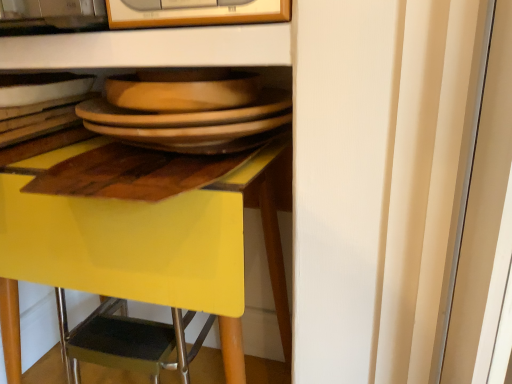
Question: Is brown matte plate at center smaller than matte wooden platter at center?

Choices:
 (A) no
 (B) yes

Answer: (B)

Question: Is brown matte plate at center located outside matte wooden platter at center?

Choices:
 (A) no
 (B) yes

Answer: (B)

Question: Considering the relative positions of brown matte plate at center and matte wooden platter at center in the image provided, is brown matte plate at center to the right of matte wooden platter at center from the viewer's perspective?

Choices:
 (A) yes
 (B) no

Answer: (A)

Question: Can you confirm if brown matte plate at center is wider than matte wooden platter at center?

Choices:
 (A) yes
 (B) no

Answer: (A)

Question: Could you tell me if brown matte plate at center is turned towards matte wooden platter at center?

Choices:
 (A) yes
 (B) no

Answer: (B)

Question: From a real-world perspective, does brown matte plate at center stand above matte wooden platter at center?

Choices:
 (A) no
 (B) yes

Answer: (A)

Question: Could you tell me if yellow glossy desk at center is turned towards brown matte plate at center?

Choices:
 (A) no
 (B) yes

Answer: (A)

Question: From a real-world perspective, is yellow glossy desk at center physically above brown matte plate at center?

Choices:
 (A) yes
 (B) no

Answer: (B)

Question: From a real-world perspective, does yellow glossy desk at center sit lower than brown matte plate at center?

Choices:
 (A) no
 (B) yes

Answer: (B)

Question: From the image's perspective, is yellow glossy desk at center over brown matte plate at center?

Choices:
 (A) no
 (B) yes

Answer: (A)

Question: Does yellow glossy desk at center have a smaller size compared to brown matte plate at center?

Choices:
 (A) no
 (B) yes

Answer: (A)

Question: Is yellow glossy desk at center far away from brown matte plate at center?

Choices:
 (A) yes
 (B) no

Answer: (B)

Question: Is the depth of yellow glossy desk at center greater than that of matte wooden platter at center?

Choices:
 (A) no
 (B) yes

Answer: (A)